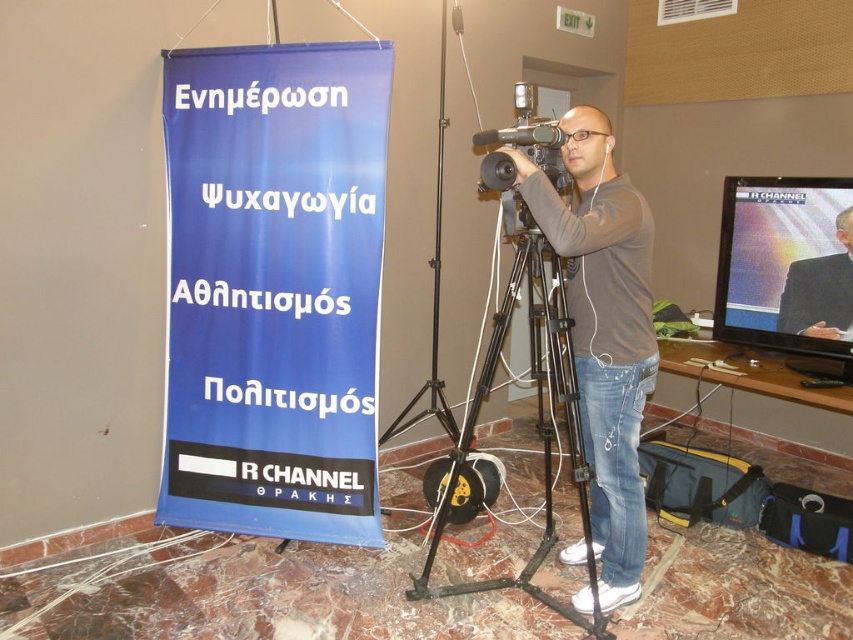
Does black metal tripod at center come behind dark gray suit at upper right?

No.

Which is in front, point (428, 544) or point (781, 308)?

Positioned in front is point (428, 544).

In order to click on black metal tripod at center in this screenshot , I will do `click(537, 426)`.

Is matte brown shirt at center thinner than dark gray suit at upper right?

Incorrect, matte brown shirt at center's width is not less than dark gray suit at upper right's.

Is matte brown shirt at center above dark gray suit at upper right?

No, matte brown shirt at center is not above dark gray suit at upper right.

At what (x,y) coordinates should I click in order to perform the action: click on matte brown shirt at center. Please return your answer as a coordinate pair (x, y). The height and width of the screenshot is (640, 853). Looking at the image, I should click on (602, 336).

The image size is (853, 640). In order to click on matte brown shirt at center in this screenshot , I will do `click(602, 336)`.

This screenshot has width=853, height=640. What do you see at coordinates (602, 336) in the screenshot?
I see `matte brown shirt at center` at bounding box center [602, 336].

Who is shorter, matte brown shirt at center or black metal tripod at center?

black metal tripod at center

The image size is (853, 640). In order to click on matte brown shirt at center in this screenshot , I will do `click(602, 336)`.